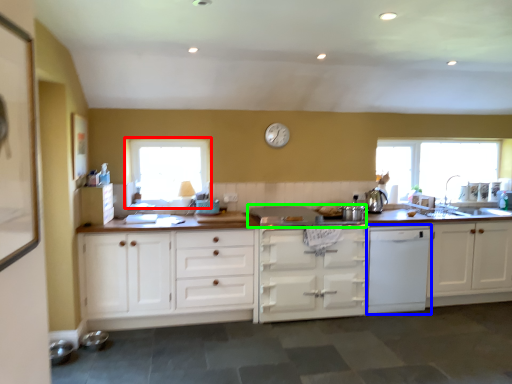
Question: Estimate the real-world distances between objects in this image. Which object is farther from window (highlighted by a red box), kitchen appliance (highlighted by a blue box) or gas stove (highlighted by a green box)?

Choices:
 (A) kitchen appliance
 (B) gas stove

Answer: (A)